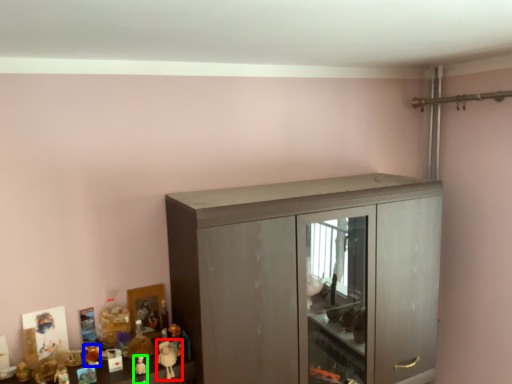
Question: Which object is positioned closest to toy (highlighted by a red box)? Select from toy (highlighted by a blue box) and toy (highlighted by a green box).

Choices:
 (A) toy
 (B) toy

Answer: (B)